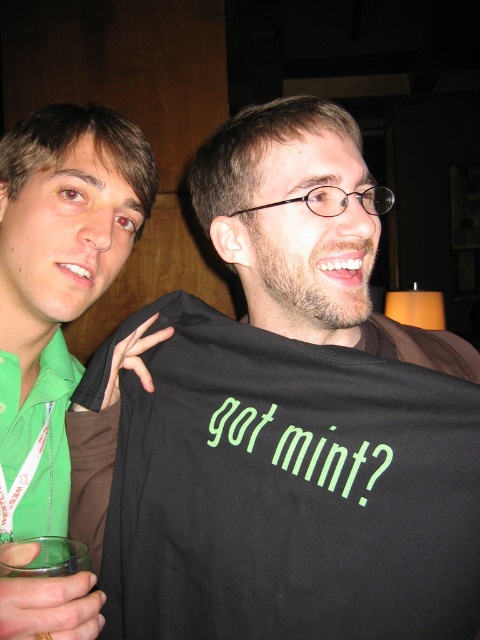
Question: Where is black fabric shirt at center located in relation to green fabric shirt at left in the image?

Choices:
 (A) right
 (B) left

Answer: (A)

Question: Which object appears closest to the camera in this image?

Choices:
 (A) green fabric shirt at left
 (B) black fabric shirt at center

Answer: (B)

Question: Which point appears closest to the camera in this image?

Choices:
 (A) 40,304
 (B) 205,209

Answer: (A)

Question: Which of the following is the farthest from the observer?

Choices:
 (A) (327, 269)
 (B) (40, 168)

Answer: (B)

Question: Is black fabric shirt at center to the right of green fabric shirt at left from the viewer's perspective?

Choices:
 (A) yes
 (B) no

Answer: (A)

Question: Can you confirm if black fabric shirt at center is positioned to the left of green fabric shirt at left?

Choices:
 (A) no
 (B) yes

Answer: (A)